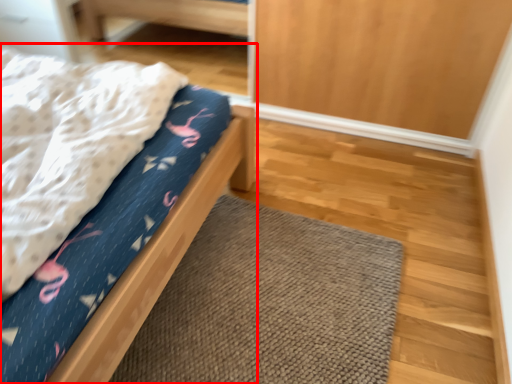
Question: Considering the relative positions of bed (annotated by the red box) and doormat in the image provided, where is bed (annotated by the red box) located with respect to the staircase?

Choices:
 (A) right
 (B) left

Answer: (B)